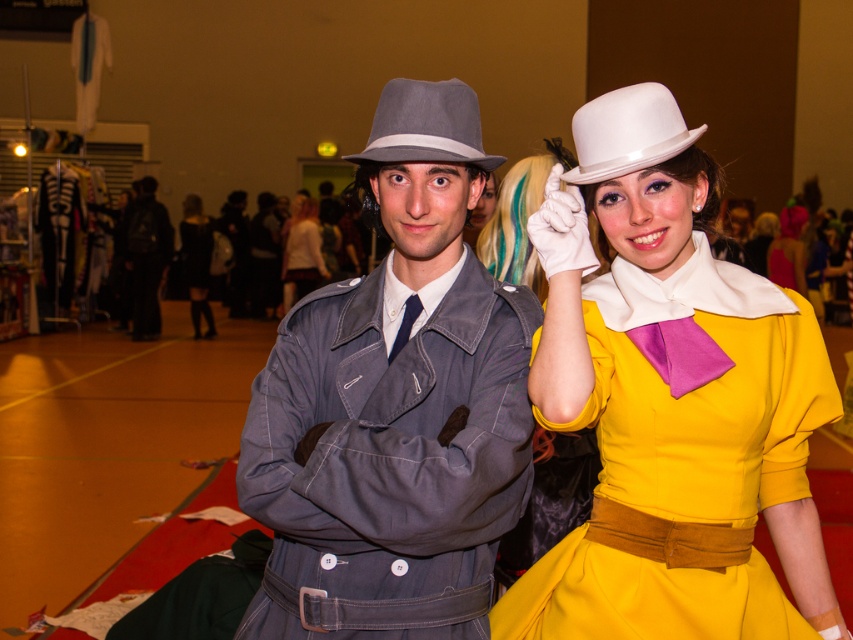
Question: From the image, what is the correct spatial relationship of white matte dress hat at upper center in relation to black leather skirt at center?

Choices:
 (A) below
 (B) above

Answer: (A)

Question: Which object is the farthest from the dark gray fabric coat at center?

Choices:
 (A) matte yellow dress at center
 (B) white satin blouse at center
 (C) matte white hat at upper right
 (D) matte gray hat at center

Answer: (A)

Question: Estimate the real-world distances between objects in this image. Which object is farther from the gray felt fedora at center?

Choices:
 (A) black leather skirt at center
 (B) yellow satin dress at center
 (C) dark gray fabric coat at center

Answer: (A)

Question: Does matte gray hat at center appear on the right side of matte white hat at upper right?

Choices:
 (A) yes
 (B) no

Answer: (B)

Question: Among these points, which one is farthest from the camera?

Choices:
 (A) (509, 241)
 (B) (212, 236)
 (C) (778, 257)

Answer: (B)

Question: In this image, where is yellow satin dress at center located relative to white satin blouse at center?

Choices:
 (A) left
 (B) right

Answer: (B)